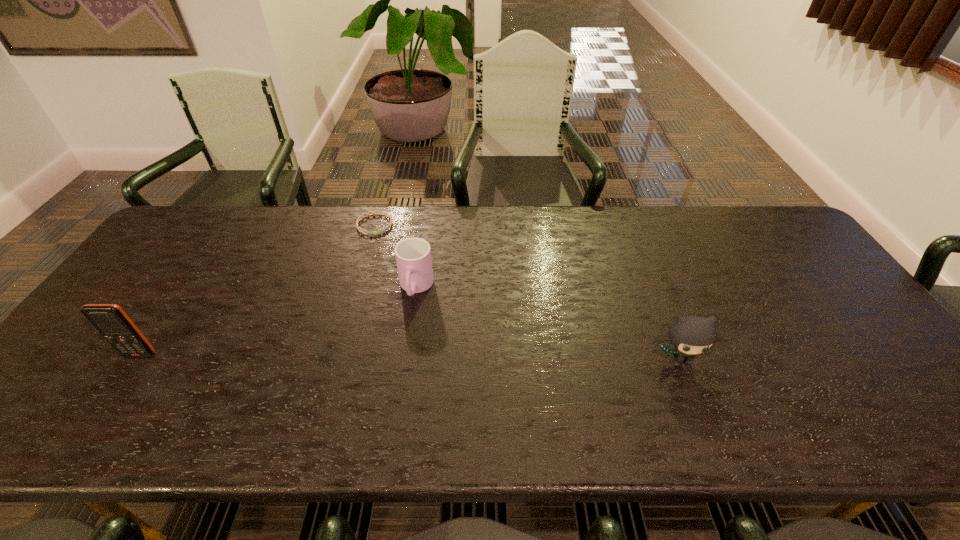
The image size is (960, 540). Identify the location of the leftmost object. (110, 320).

Where is `the tallest object`? This screenshot has height=540, width=960. the tallest object is located at coordinates (110, 320).

I want to click on kitten, so click(x=691, y=335).

Where is `bracelet`? Image resolution: width=960 pixels, height=540 pixels. bracelet is located at coordinates (362, 231).

Locate an element on the screen. Image resolution: width=960 pixels, height=540 pixels. the second object from left to right is located at coordinates (362, 231).

Identify the location of the second farthest object. This screenshot has width=960, height=540. (413, 255).

The width and height of the screenshot is (960, 540). In order to click on the third tallest object in this screenshot , I will do `click(413, 255)`.

Find the location of `blank space located on the screen of the leftmost object`. blank space located on the screen of the leftmost object is located at coordinates (126, 376).

The height and width of the screenshot is (540, 960). Find the location of `free space located 0.050m on the front-facing side of the rightmost object`. free space located 0.050m on the front-facing side of the rightmost object is located at coordinates (692, 393).

Where is `free region located on the surface of the second object from left to right showing star-shaped elements`? The height and width of the screenshot is (540, 960). free region located on the surface of the second object from left to right showing star-shaped elements is located at coordinates (389, 248).